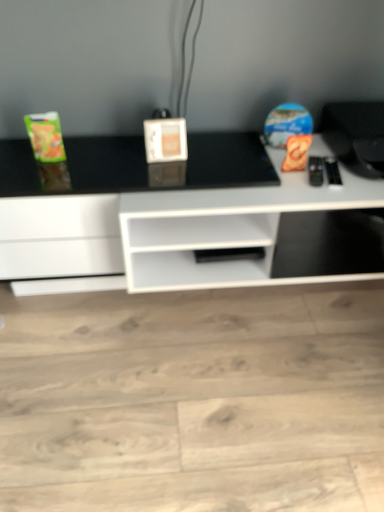
In order to face white glossy desk at center, should I rotate leftwards or rightwards?

Rotate right and turn 3.678 degrees.

The height and width of the screenshot is (512, 384). Find the location of `white glossy desk at center`. white glossy desk at center is located at coordinates (192, 234).

Describe the element at coordinates (192, 234) in the screenshot. The width and height of the screenshot is (384, 512). I see `white glossy desk at center` at that location.

The width and height of the screenshot is (384, 512). I want to click on white glossy desk at center, so click(x=192, y=234).